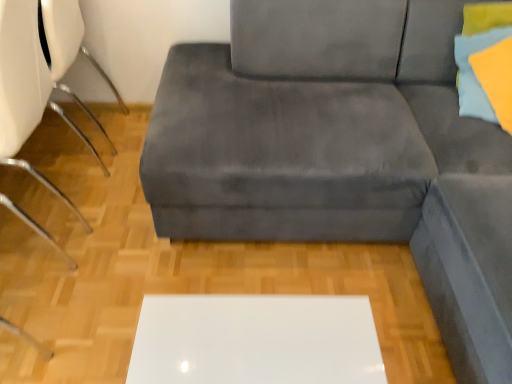
Question: From a real-world perspective, relative to velvet gray couch at center, is white plastic chair at left vertically above or below?

Choices:
 (A) above
 (B) below

Answer: (A)

Question: From the image's perspective, is white plastic chair at left positioned above or below velvet gray couch at center?

Choices:
 (A) below
 (B) above

Answer: (B)

Question: Which object is positioned farthest from the white glossy table at center?

Choices:
 (A) white plastic swivel chair at left
 (B) velvet gray couch at center
 (C) matte yellow pillow at upper right
 (D) white plastic chair at left

Answer: (A)

Question: Estimate the real-world distances between objects in this image. Which object is closer to the white glossy table at center?

Choices:
 (A) velvet gray couch at center
 (B) matte yellow pillow at upper right
 (C) white plastic chair at left
 (D) white plastic swivel chair at left

Answer: (A)